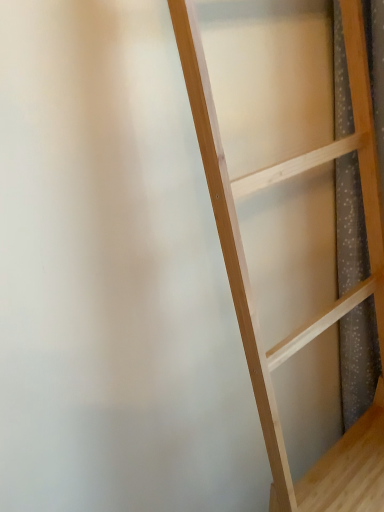
Find the location of `natural wood ladder at center`. natural wood ladder at center is located at coordinates (328, 308).

The height and width of the screenshot is (512, 384). Describe the element at coordinates (328, 308) in the screenshot. I see `natural wood ladder at center` at that location.

Locate an element on the screen. natural wood ladder at center is located at coordinates (328, 308).